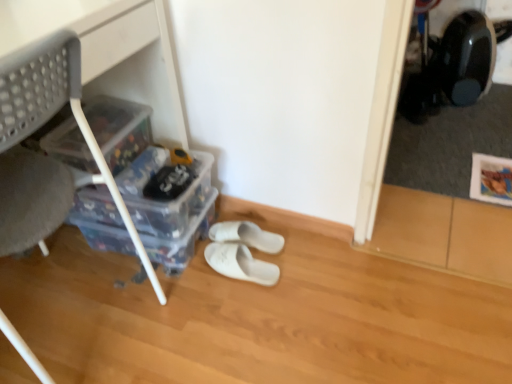
Image resolution: width=512 pixels, height=384 pixels. Find the location of `vacant area that is in front of transparent plastic storage box at lower left, positioned as the third storage box in top-to-bottom order`. vacant area that is in front of transparent plastic storage box at lower left, positioned as the third storage box in top-to-bottom order is located at coordinates (135, 306).